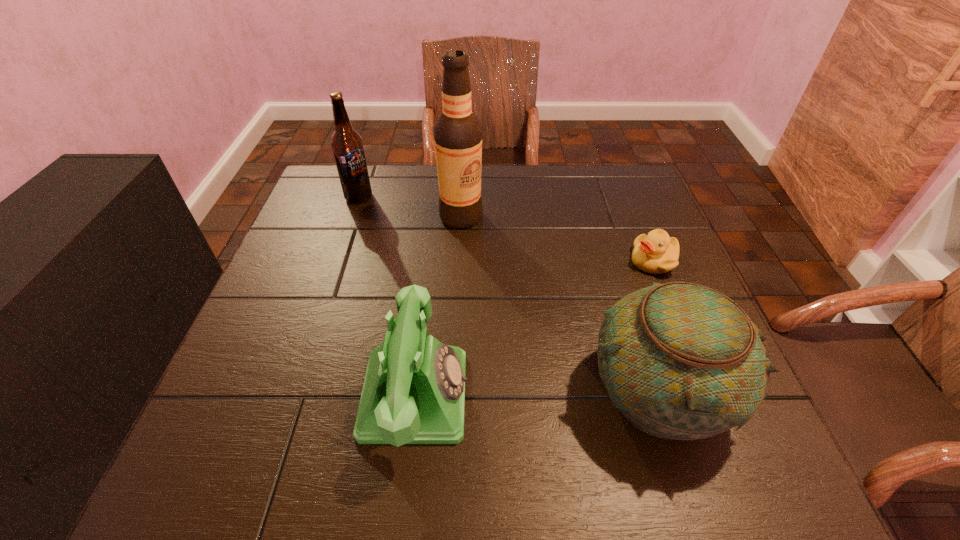
Locate an element on the screen. vacant spot on the desktop that is between the second shortest object and the pottery and is positioned on the front-facing side of the third nearest object is located at coordinates (540, 392).

Find the location of `free spot on the desktop that is between the telephone and the pottery and is positioned on the label of the alcohol`. free spot on the desktop that is between the telephone and the pottery and is positioned on the label of the alcohol is located at coordinates (538, 392).

Find the location of a particular element. This screenshot has height=540, width=960. vacant space on the desktop that is between the second shortest object and the pottery and is positioned on the label of the fourth shortest object is located at coordinates pos(511,393).